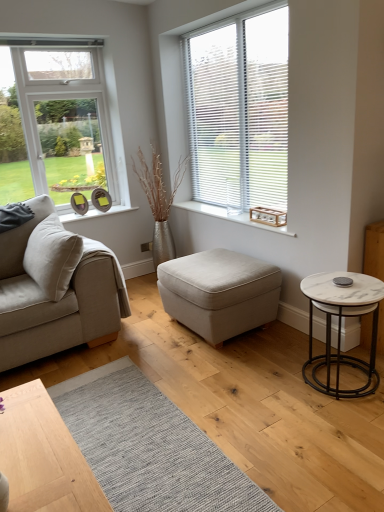
Identify the location of free point above wooden crate at center (from a real-world perspective). Image resolution: width=384 pixels, height=512 pixels. (225, 212).